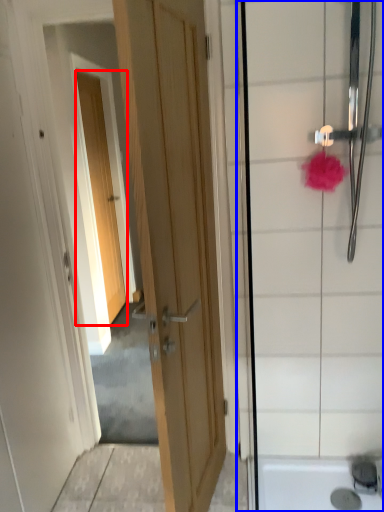
Question: Which object is further to the camera taking this photo, door (highlighted by a red box) or shower door (highlighted by a blue box)?

Choices:
 (A) door
 (B) shower door

Answer: (A)